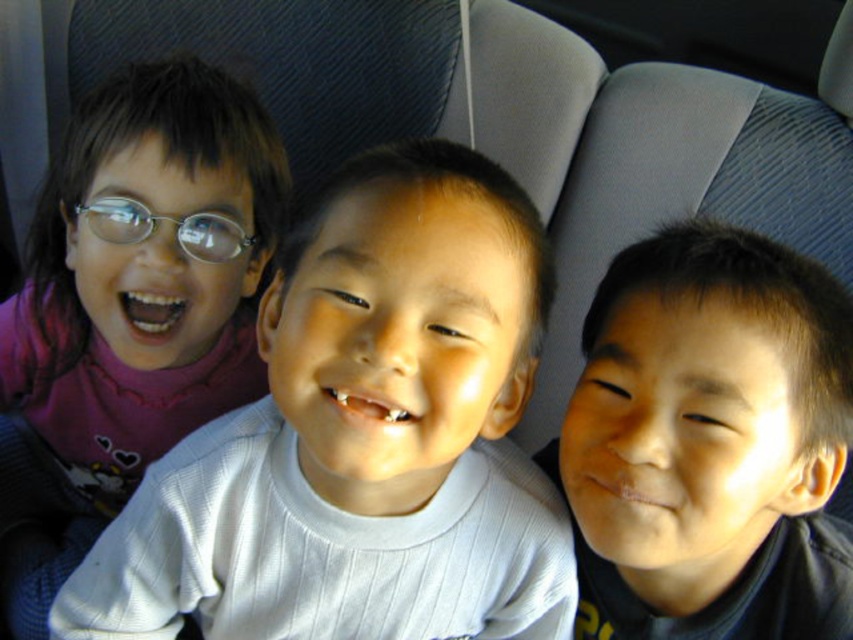
Who is taller, smooth skin face at center or purple fleece shirt at left?

With more height is purple fleece shirt at left.

Can you confirm if smooth skin face at center is taller than purple fleece shirt at left?

No.

You are a GUI agent. You are given a task and a screenshot of the screen. Output one action in this format:
    pyautogui.click(x=<x>, y=<y>)
    Task: Click on the smooth skin face at center
    
    Given the screenshot: What is the action you would take?
    pyautogui.click(x=711, y=442)

Which is more to the right, smooth skin face at center or metallic silver glasses at left?

smooth skin face at center

Does point (572, 497) come closer to viewer compared to point (136, 218)?

Yes, point (572, 497) is closer to viewer.

Locate an element on the screen. Image resolution: width=853 pixels, height=640 pixels. smooth skin face at center is located at coordinates (711, 442).

Is the position of pink fabric shirt at left more distant than that of metallic silver glasses at left?

That is False.

Can you confirm if pink fabric shirt at left is positioned to the right of metallic silver glasses at left?

Indeed, pink fabric shirt at left is positioned on the right side of metallic silver glasses at left.

Who is more forward, (224, 442) or (245, 246)?

Point (224, 442) is in front.

This screenshot has width=853, height=640. I want to click on pink fabric shirt at left, so click(360, 436).